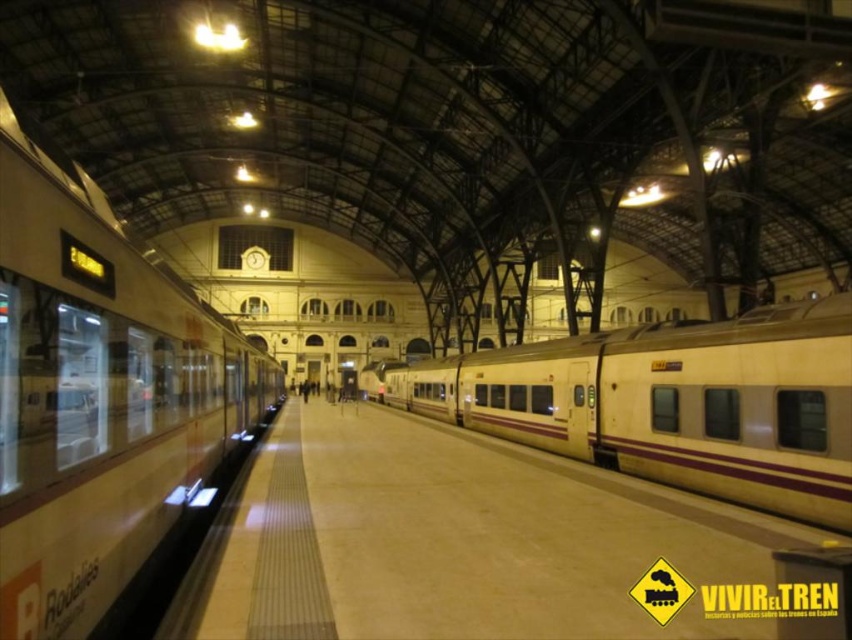
Does yellow/smooth train at center appear over matte beige train at center?

Actually, yellow/smooth train at center is below matte beige train at center.

Which is more to the right, yellow/smooth train at center or matte beige train at center?

matte beige train at center

What do you see at coordinates (462, 541) in the screenshot? I see `yellow/smooth train at center` at bounding box center [462, 541].

You are a GUI agent. You are given a task and a screenshot of the screen. Output one action in this format:
    pyautogui.click(x=<x>, y=<y>)
    Task: Click on the yellow/smooth train at center
    This screenshot has height=640, width=852.
    Given the screenshot: What is the action you would take?
    [462, 541]

Can you confirm if yellow/smooth train at center is taller than matte beige train at left?

In fact, yellow/smooth train at center may be shorter than matte beige train at left.

Is point (210, 614) in front of point (0, 538)?

No.

Which is behind, point (749, 513) or point (79, 636)?

The point (749, 513) is behind.

Locate an element on the screen. yellow/smooth train at center is located at coordinates (462, 541).

Is matte beige train at left closer to the viewer compared to matte beige train at center?

Yes, it is in front of matte beige train at center.

In the scene shown: Is matte beige train at left smaller than matte beige train at center?

Correct, matte beige train at left occupies less space than matte beige train at center.

Does point (41, 426) come behind point (750, 394)?

No.

At what (x,y) coordinates should I click in order to perform the action: click on matte beige train at left. Please return your answer as a coordinate pair (x, y). Looking at the image, I should click on (99, 396).